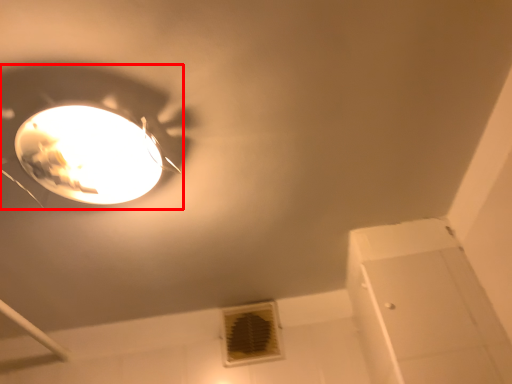
Question: Considering the relative positions of lamp (annotated by the red box) and air conditioning in the image provided, where is lamp (annotated by the red box) located with respect to the staircase?

Choices:
 (A) right
 (B) left

Answer: (B)